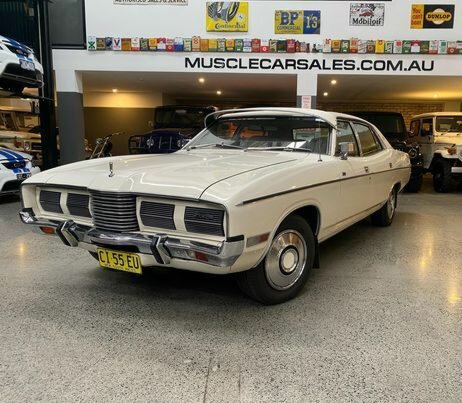
Locate an element on the screen. handle is located at coordinates (397, 167), (369, 177), (419, 141).